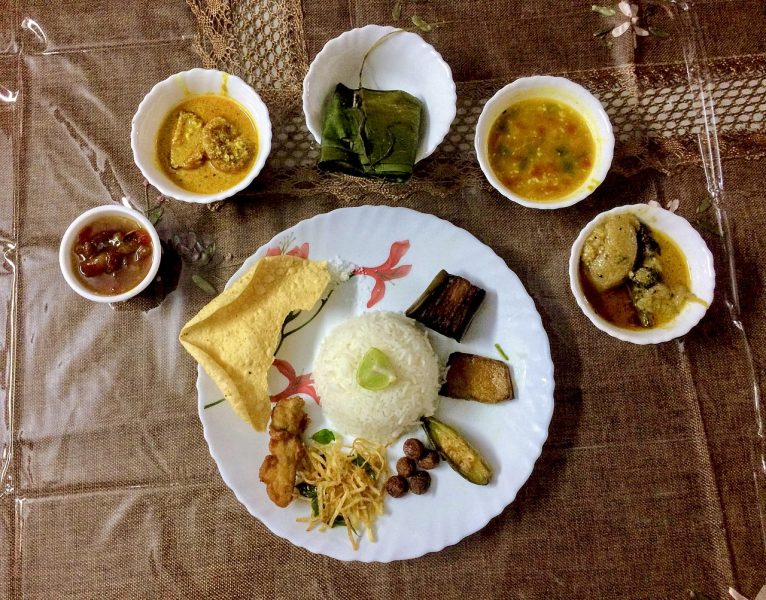
I want to click on plate, so click(x=424, y=519).